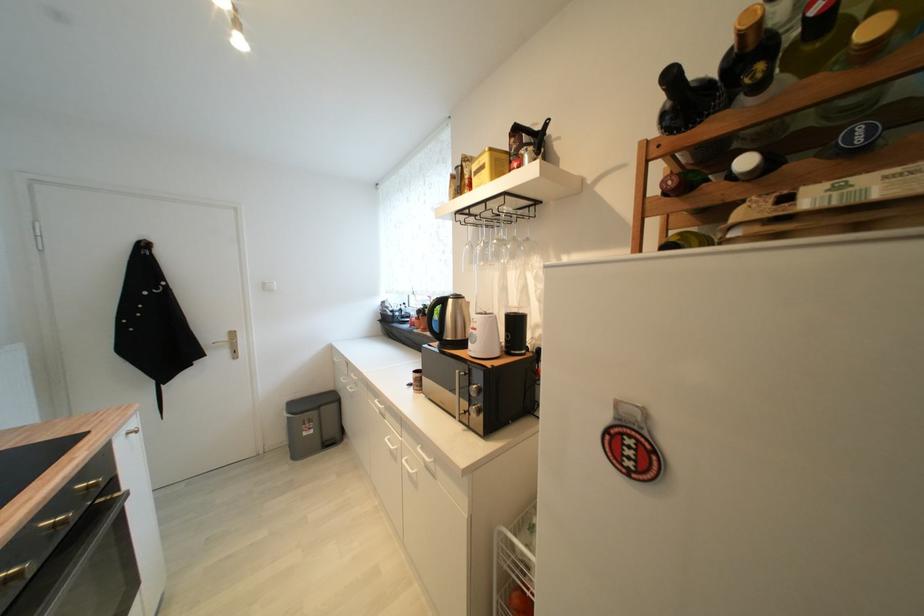
Find where to pull the gold oven handle. Please return your answer as a coordinate pair (x, y).

(86, 568)